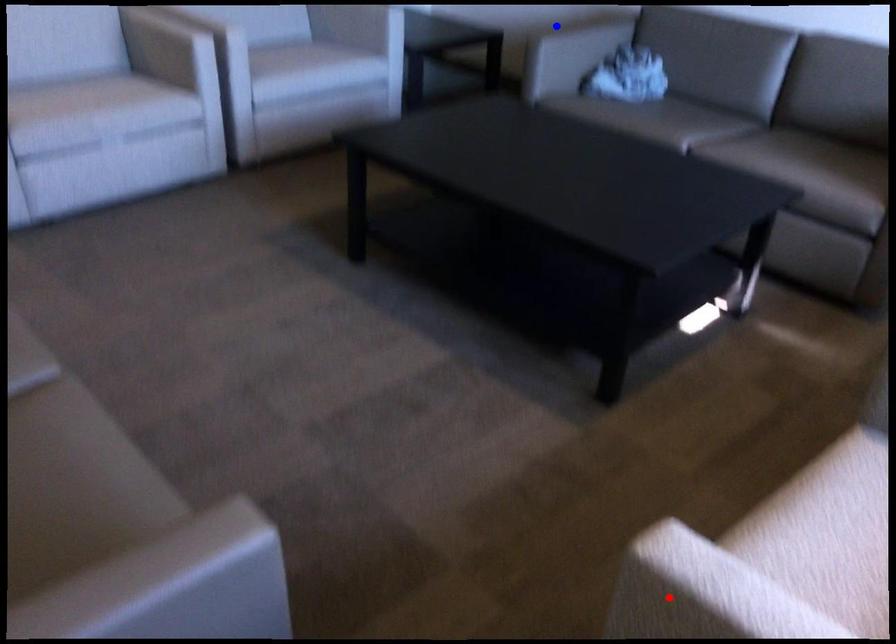
Question: Which of the two points in the image is closer to the camera?

Choices:
 (A) Blue point is closer.
 (B) Red point is closer.

Answer: (B)